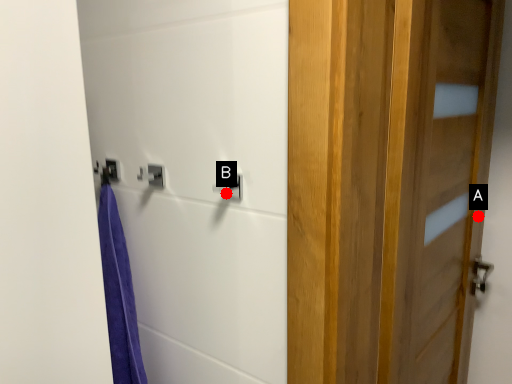
Question: Two points are circled on the image, labeled by A and B beside each circle. Which point is closer to the camera taking this photo?

Choices:
 (A) A is closer
 (B) B is closer

Answer: (B)